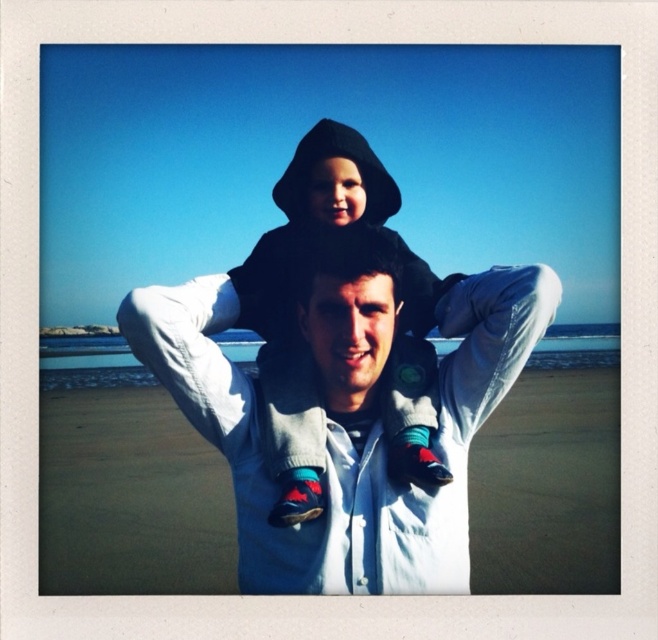
You are a photographer trying to capture the scene. You notice the white matte jacket at center and the black hoodie at center. Which piece of clothing is positioned to the left when looking at the image?

The white matte jacket at center is to the left of the black hoodie at center, so the white matte jacket at center is positioned to the left.

You are a photographer at the beach and want to capture a photo of the black hoodie at center and the smooth white hoodie at center. Which hoodie should you zoom in on to focus on the one that takes up more space in the photo?

The smooth white hoodie at center has a greater width than the black hoodie at center, so you should zoom in on the smooth white hoodie at center to focus on the one that takes up more space in the photo.

You are a photographer trying to capture the scene with a camera that has a 1.2 meter wide frame. You see the white matte jacket at center and the black hoodie at center in your viewfinder. Can both objects fit within the frame if they are positioned side by side horizontally?

The white matte jacket at center might be wider than black hoodie at center, so it is uncertain if both can fit within the 1.2 meter wide frame without overlapping or going out of bounds. The photographer should adjust the camera angle or zoom to ensure proper framing.